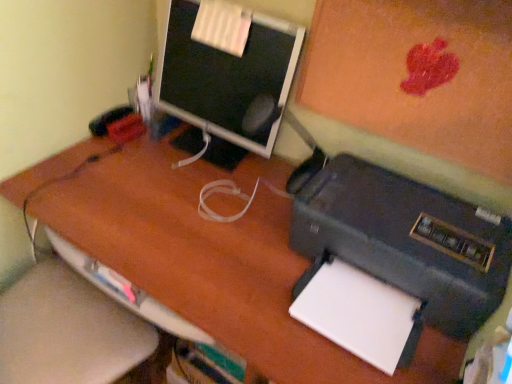
The height and width of the screenshot is (384, 512). In order to click on vacant space to the left of white paper at lower right in this screenshot , I will do `click(265, 301)`.